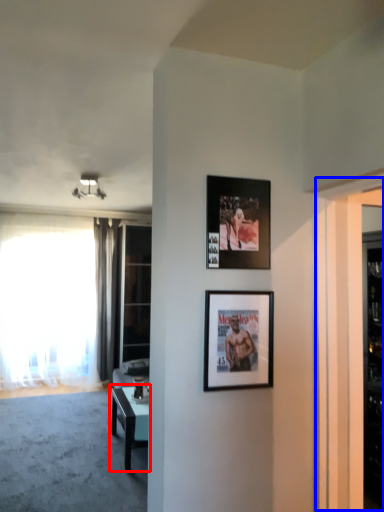
Question: Which point is closer to the camera, table (highlighted by a red box) or screen door (highlighted by a blue box)?

Choices:
 (A) table
 (B) screen door

Answer: (B)